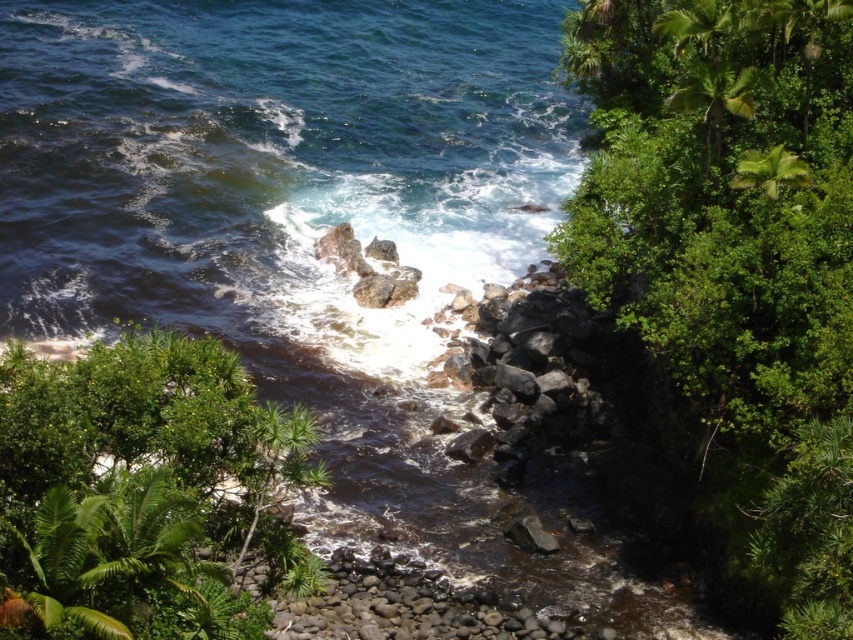
You are a hiker who wants to take a photo of the green leafy shrubs at right and the green leafy shrub at lower left. Which shrub should you focus on if you want to capture the tallest one in your photo?

The green leafy shrubs at right is taller than the green leafy shrub at lower left, so you should focus on the green leafy shrubs at right to capture the tallest one in your photo.

You are a gardener planning to plant new shrubs in an area that can only accommodate plants up to the size of the green leafy shrub at lower left. Based on the scene, will the green leafy shrubs at right fit in that space?

The green leafy shrubs at right are wider than the green leafy shrub at lower left. Since the available space can only accommodate the smaller shrub, the larger shrubs at right will not fit in that space.

You are standing at the shoreline looking towards the vegetation. There are two points marked in the image, one at point coordinates point (821, 577) and another at point coordinates point (15, 538). Which point is closer to your current position?

Point (15, 538) is closer to your current position because it is closer to the camera than point (821, 577).